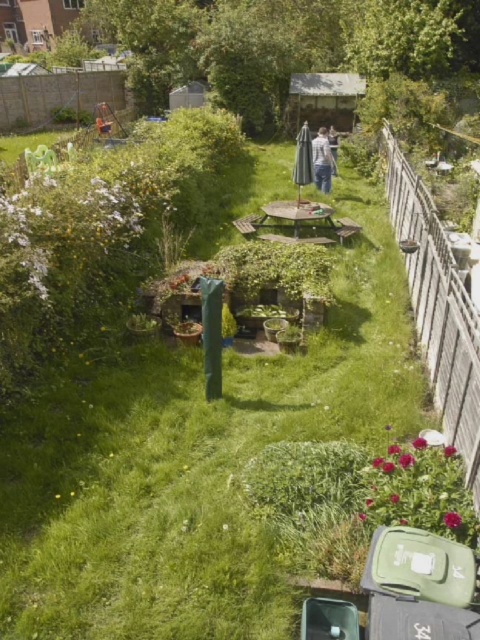
In the scene shown: You are standing in the garden and want to hang a small bird feeder on the closest object. Which object should you choose between the white wooden fence at right and the white cotton shirt at center?

The white wooden fence at right is closer to the viewer than the white cotton shirt at center, so you should hang the bird feeder on the white wooden fence at right.

You are standing in the garden and want to move from the white cotton shirt at center to the white wooden fence at right. Which direction should you walk to get there?

To move from the white cotton shirt at center to the white wooden fence at right, you should walk to the right since the white wooden fence at right is located to the right of the white cotton shirt at center.